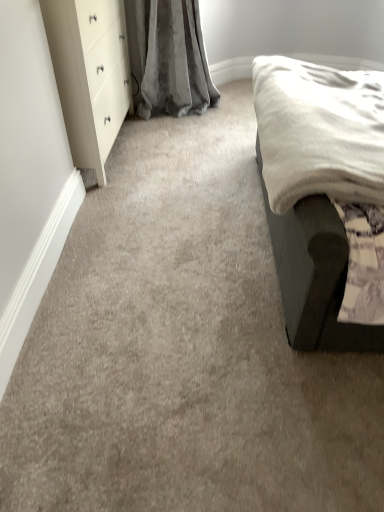
Question: Is dark gray fabric bed at right beside white glossy dresser at upper left?

Choices:
 (A) no
 (B) yes

Answer: (A)

Question: Is dark gray fabric bed at right taller than white glossy dresser at upper left?

Choices:
 (A) yes
 (B) no

Answer: (A)

Question: From a real-world perspective, is dark gray fabric bed at right located beneath white glossy dresser at upper left?

Choices:
 (A) yes
 (B) no

Answer: (B)

Question: Could you tell me if dark gray fabric bed at right is turned towards white glossy dresser at upper left?

Choices:
 (A) no
 (B) yes

Answer: (B)

Question: Can you confirm if dark gray fabric bed at right is wider than white glossy dresser at upper left?

Choices:
 (A) no
 (B) yes

Answer: (B)

Question: Is the depth of dark gray fabric bed at right greater than that of white glossy dresser at upper left?

Choices:
 (A) yes
 (B) no

Answer: (B)

Question: Is white glossy dresser at upper left to the left of dark gray fabric bed at right from the viewer's perspective?

Choices:
 (A) no
 (B) yes

Answer: (B)

Question: Considering the relative sizes of white glossy dresser at upper left and dark gray fabric bed at right in the image provided, is white glossy dresser at upper left smaller than dark gray fabric bed at right?

Choices:
 (A) no
 (B) yes

Answer: (B)

Question: From the image's perspective, is white glossy dresser at upper left over dark gray fabric bed at right?

Choices:
 (A) no
 (B) yes

Answer: (B)

Question: Is white glossy dresser at upper left positioned behind dark gray fabric bed at right?

Choices:
 (A) yes
 (B) no

Answer: (A)

Question: From the image's perspective, is white glossy dresser at upper left beneath dark gray fabric bed at right?

Choices:
 (A) no
 (B) yes

Answer: (A)

Question: Considering the relative positions of white glossy dresser at upper left and dark gray fabric bed at right in the image provided, is white glossy dresser at upper left in front of dark gray fabric bed at right?

Choices:
 (A) yes
 (B) no

Answer: (B)

Question: In the image, is white glossy dresser at upper left on the left side or the right side of dark gray fabric bed at right?

Choices:
 (A) right
 (B) left

Answer: (B)